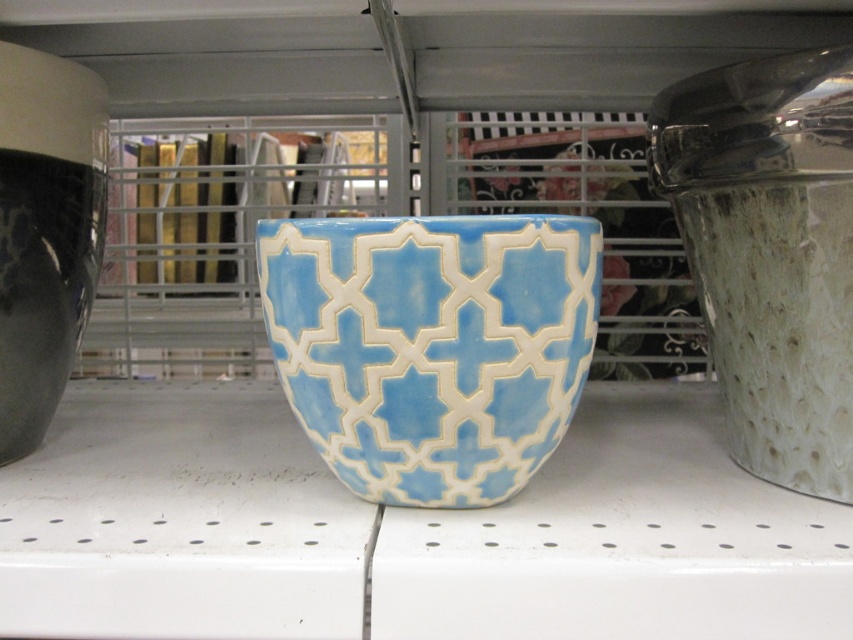
The width and height of the screenshot is (853, 640). What do you see at coordinates (770, 252) in the screenshot? I see `textured glass jar at right` at bounding box center [770, 252].

Is point (747, 419) in front of point (85, 173)?

Yes, it is.

You are a GUI agent. You are given a task and a screenshot of the screen. Output one action in this format:
    pyautogui.click(x=<x>, y=<y>)
    Task: Click on the textured glass jar at right
    
    Given the screenshot: What is the action you would take?
    pyautogui.click(x=770, y=252)

Is light blue glazed bowl at center positioned at the back of matte black vase at left?

No.

Is point (521, 282) positioned behind point (4, 276)?

No, it is not.

Image resolution: width=853 pixels, height=640 pixels. I want to click on light blue glazed bowl at center, so click(431, 348).

Between light blue glazed bowl at center and textured glass jar at right, which one has less height?

With less height is light blue glazed bowl at center.

Is light blue glazed bowl at center positioned at the back of textured glass jar at right?

No, light blue glazed bowl at center is in front of textured glass jar at right.

Where is `light blue glazed bowl at center`? light blue glazed bowl at center is located at coordinates (431, 348).

Identify the location of light blue glazed bowl at center. (431, 348).